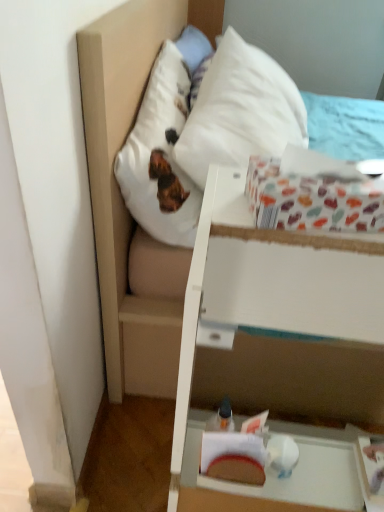
Where is `vacant space situated on the left part of multicolored paper at upper right`? The width and height of the screenshot is (384, 512). vacant space situated on the left part of multicolored paper at upper right is located at coordinates point(228,205).